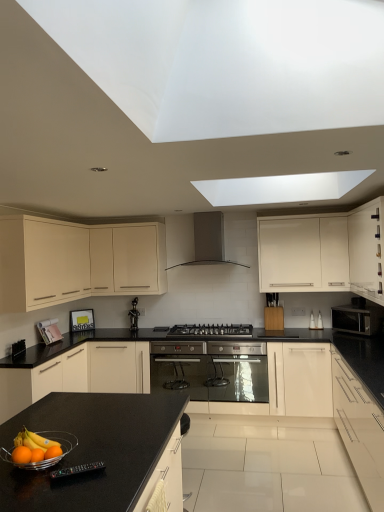
Question: From a real-world perspective, is matte white cabinet at upper center, positioned as the third cabinetry in left-to-right order, physically above black glossy statue at center, acting as the first appliance starting from the left?

Choices:
 (A) yes
 (B) no

Answer: (A)

Question: Would you say matte white cabinet at upper center, the fourth cabinetry from the right, contains black glossy statue at center, acting as the first appliance starting from the left?

Choices:
 (A) yes
 (B) no

Answer: (B)

Question: Considering the relative sizes of matte white cabinet at upper center, the fourth cabinetry from the right, and black glossy statue at center, which appears as the 1th appliance when viewed from the top, in the image provided, is matte white cabinet at upper center, the fourth cabinetry from the right, thinner than black glossy statue at center, which appears as the 1th appliance when viewed from the top,?

Choices:
 (A) yes
 (B) no

Answer: (B)

Question: Is matte white cabinet at upper center, positioned as the third cabinetry in left-to-right order, oriented towards black glossy statue at center, which appears as the 1th appliance when viewed from the top?

Choices:
 (A) yes
 (B) no

Answer: (B)

Question: Considering the relative positions of matte white cabinet at upper center, the fourth cabinetry from the right, and black glossy statue at center, which appears as the 1th appliance when viewed from the top, in the image provided, is matte white cabinet at upper center, the fourth cabinetry from the right, to the right of black glossy statue at center, which appears as the 1th appliance when viewed from the top, from the viewer's perspective?

Choices:
 (A) yes
 (B) no

Answer: (B)

Question: Can you see matte white cabinet at upper center, positioned as the third cabinetry in left-to-right order, touching black glossy statue at center, positioned as the third appliance in bottom-to-top order?

Choices:
 (A) yes
 (B) no

Answer: (B)

Question: From a real-world perspective, is orange matte at lower left physically above matte white cabinet at upper center, the fourth cabinetry from the right?

Choices:
 (A) no
 (B) yes

Answer: (A)

Question: Could you tell me if orange matte at lower left is turned towards matte white cabinet at upper center, positioned as the third cabinetry in left-to-right order?

Choices:
 (A) no
 (B) yes

Answer: (A)

Question: Is orange matte at lower left smaller than matte white cabinet at upper center, the fourth cabinetry from the right?

Choices:
 (A) yes
 (B) no

Answer: (A)

Question: Is orange matte at lower left shorter than matte white cabinet at upper center, positioned as the third cabinetry in left-to-right order?

Choices:
 (A) no
 (B) yes

Answer: (B)

Question: From a real-world perspective, is orange matte at lower left beneath matte white cabinet at upper center, the fourth cabinetry from the right?

Choices:
 (A) yes
 (B) no

Answer: (A)

Question: Is orange matte at lower left to the left of matte white cabinet at upper center, the fourth cabinetry from the right, from the viewer's perspective?

Choices:
 (A) yes
 (B) no

Answer: (A)

Question: From the image's perspective, would you say orange matte at lower left is shown under white glossy cabinet at right, positioned as the 5th cabinetry in left-to-right order?

Choices:
 (A) yes
 (B) no

Answer: (B)